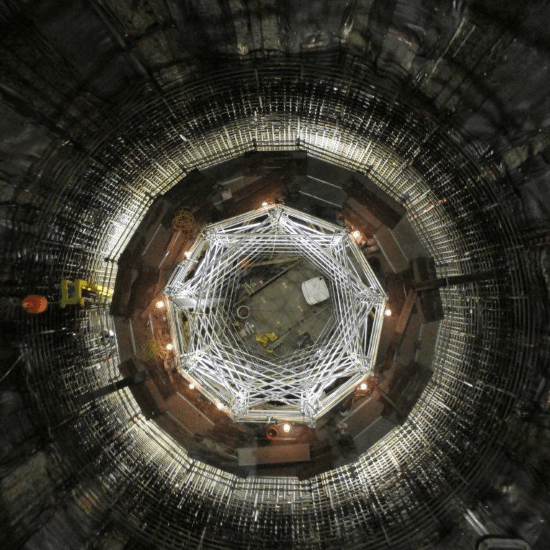
At what (x,y) coordinates should I click in order to perform the action: click on concrete floor. Please return your answer as a coordinate pair (x, y). The width and height of the screenshot is (550, 550). Looking at the image, I should click on (265, 294), (285, 313).